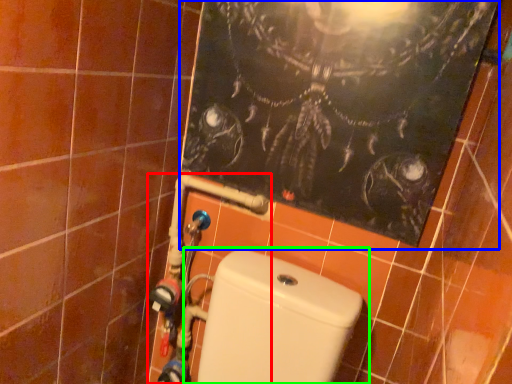
Question: Estimate the real-world distances between objects in this image. Which object is closer to water pipe (highlighted by a red box), bulletin board (highlighted by a blue box) or toilet (highlighted by a green box)?

Choices:
 (A) bulletin board
 (B) toilet

Answer: (B)